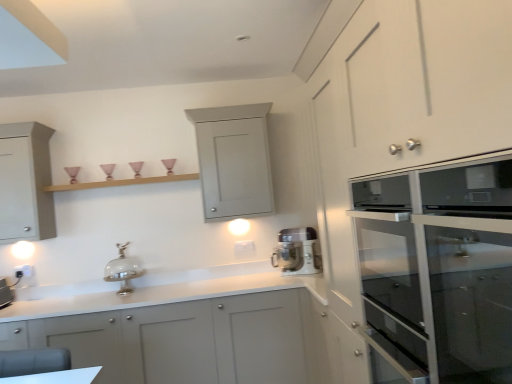
Question: Considering the relative sizes of matte glass oven at right, positioned as the fourth cabinetry in back-to-front order, and white plastic electric outlet at lower left in the image provided, is matte glass oven at right, positioned as the fourth cabinetry in back-to-front order, wider than white plastic electric outlet at lower left?

Choices:
 (A) no
 (B) yes

Answer: (B)

Question: Is matte glass oven at right, positioned as the fourth cabinetry in back-to-front order, in contact with white plastic electric outlet at lower left?

Choices:
 (A) no
 (B) yes

Answer: (A)

Question: Does matte glass oven at right, the first cabinetry from the front, have a lesser height compared to white plastic electric outlet at lower left?

Choices:
 (A) yes
 (B) no

Answer: (B)

Question: Is matte glass oven at right, the first cabinetry from the front, to the right of white plastic electric outlet at lower left from the viewer's perspective?

Choices:
 (A) yes
 (B) no

Answer: (A)

Question: Can you confirm if matte glass oven at right, positioned as the fourth cabinetry in back-to-front order, is smaller than white plastic electric outlet at lower left?

Choices:
 (A) yes
 (B) no

Answer: (B)

Question: Looking at their shapes, would you say matte gray cabinet at left, which ranks as the third cabinetry in front-to-back order, is wider or thinner than shiny silver cake stand at center?

Choices:
 (A) wide
 (B) thin

Answer: (A)

Question: Would you say matte gray cabinet at left, which ranks as the third cabinetry in front-to-back order, is to the left or to the right of shiny silver cake stand at center in the picture?

Choices:
 (A) right
 (B) left

Answer: (B)

Question: From a real-world perspective, is matte gray cabinet at left, which ranks as the third cabinetry in front-to-back order, physically located above or below shiny silver cake stand at center?

Choices:
 (A) above
 (B) below

Answer: (A)

Question: Considering the positions of point (29, 231) and point (120, 243), is point (29, 231) closer or farther from the camera than point (120, 243)?

Choices:
 (A) farther
 (B) closer

Answer: (B)

Question: Does point (202, 185) appear closer or farther from the camera than point (131, 288)?

Choices:
 (A) farther
 (B) closer

Answer: (B)

Question: Is matte gray cabinet at upper center, the fourth cabinetry from the front, taller or shorter than shiny silver cake stand at center?

Choices:
 (A) tall
 (B) short

Answer: (A)

Question: Would you say matte gray cabinet at upper center, the 1th cabinetry positioned from the back, is to the left or to the right of shiny silver cake stand at center in the picture?

Choices:
 (A) right
 (B) left

Answer: (A)

Question: Relative to shiny silver cake stand at center, is matte gray cabinet at upper center, the fourth cabinetry from the front, in front or behind?

Choices:
 (A) behind
 (B) front

Answer: (A)

Question: In terms of height, does wooden shelf at upper center look taller or shorter compared to matte gray cabinet at lower left, the third cabinetry when ordered from back to front?

Choices:
 (A) short
 (B) tall

Answer: (A)

Question: Is wooden shelf at upper center in front of or behind matte gray cabinet at lower left, which is counted as the 2th cabinetry, starting from the front, in the image?

Choices:
 (A) front
 (B) behind

Answer: (B)